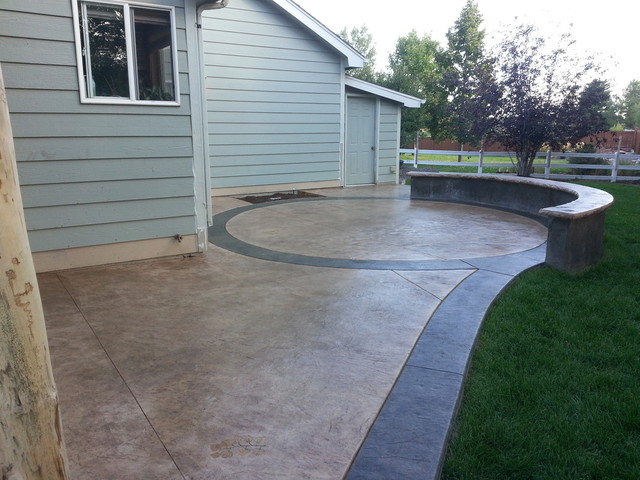
This screenshot has width=640, height=480. Identify the location of window. (116, 79), (148, 80).